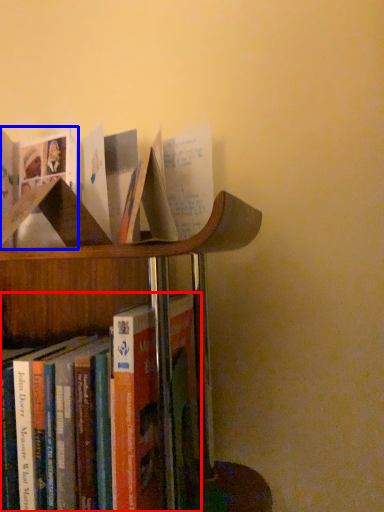
Question: Which of the following is the farthest to the observer, book (highlighted by a red box) or book (highlighted by a blue box)?

Choices:
 (A) book
 (B) book

Answer: (A)